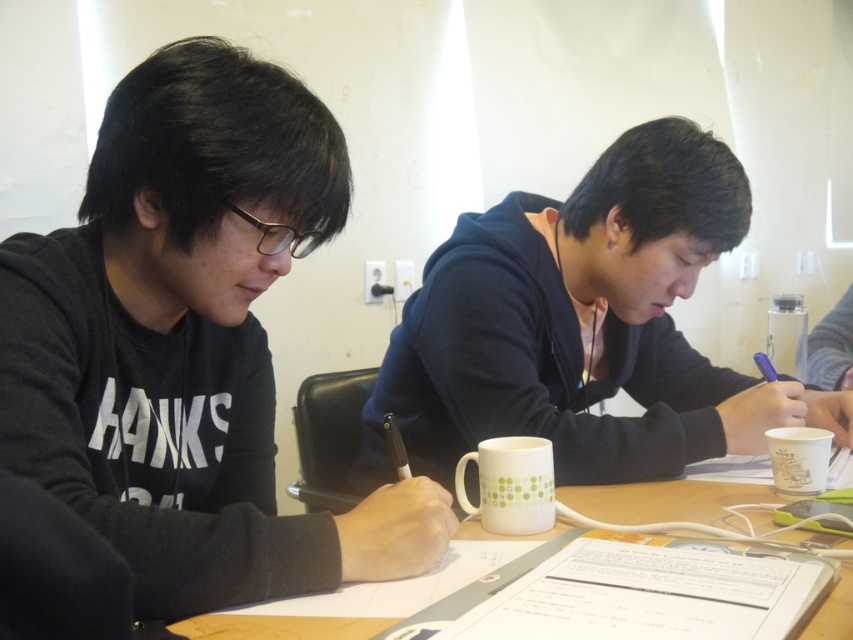
Who is taller, white paper at center or white matte mug at center?

Standing taller between the two is white matte mug at center.

Is white paper at center thinner than white matte mug at center?

No.

You are a GUI agent. You are given a task and a screenshot of the screen. Output one action in this format:
    pyautogui.click(x=<x>, y=<y>)
    Task: Click on the white paper at center
    The height and width of the screenshot is (640, 853).
    Given the screenshot: What is the action you would take?
    pyautogui.click(x=666, y=500)

Image resolution: width=853 pixels, height=640 pixels. Identify the location of white paper at center. (666, 500).

Does black matte hoodie at left lie behind white paper cup at lower right?

No.

Between point (183, 554) and point (786, 465), which one is positioned in front?

Positioned in front is point (183, 554).

Does point (236, 186) come farther from viewer compared to point (801, 490)?

No.

Where is `black matte hoodie at left`? Image resolution: width=853 pixels, height=640 pixels. black matte hoodie at left is located at coordinates (189, 340).

At what (x,y) coordinates should I click in order to perform the action: click on black matte hoodie at left. Please return your answer as a coordinate pair (x, y). The height and width of the screenshot is (640, 853). Looking at the image, I should click on (189, 340).